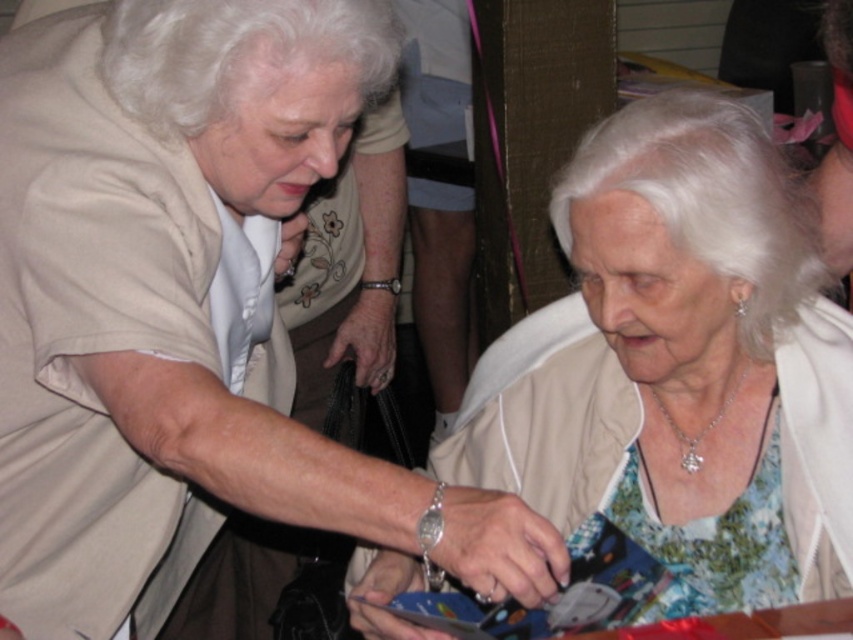
You are designing a catalog for clothing items and need to arrange the matte beige blouse at center and the matte beige jacket at center in a way that highlights their size differences. Which item should be placed in a larger display area to accurately represent their sizes?

The matte beige blouse at center has a larger size compared to the matte beige jacket at center, so it should be placed in a larger display area to accurately represent their sizes.

You are a photographer trying to capture a closeup of both the matte beige blouse at center and the matte beige jacket at center in the image. Given that your camera can only focus on objects within a 12 inch range, will you be able to get both items in focus?

The matte beige blouse at center and matte beige jacket at center are 14.35 inches apart, which exceeds the camera focus range of 12 inches. Therefore, you cannot get both items in focus at the same time.

You are a photographer taking a picture of two women. You notice two points in the scene at coordinates point [473,564] and point [701,144]. Which point is closer to your camera?

Point [473,564] is closer to the camera than point [701,144].